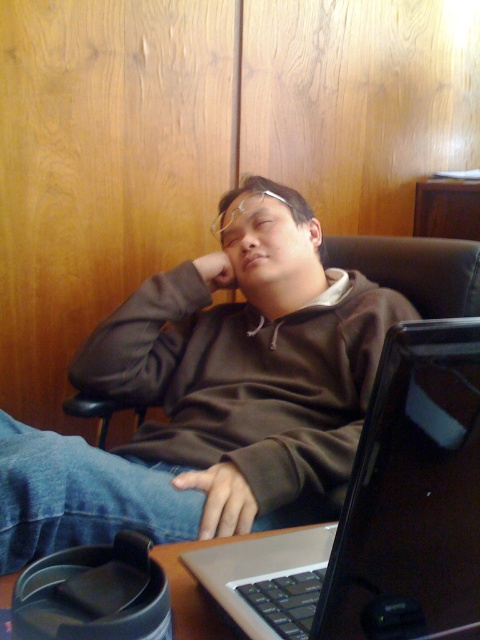
Question: Estimate the real-world distances between objects in this image. Which object is closer to the brown fleece at center?

Choices:
 (A) metallic silver laptop at lower center
 (B) silver metallic laptop at center

Answer: (A)

Question: Which point is closer to the camera?

Choices:
 (A) (335, 529)
 (B) (207, 621)
 (C) (361, 412)

Answer: (B)

Question: Can you confirm if brown fleece at center is thinner than silver metallic laptop at center?

Choices:
 (A) no
 (B) yes

Answer: (A)

Question: Which of the following is the closest to the observer?

Choices:
 (A) (269, 570)
 (B) (43, 476)

Answer: (A)

Question: From the image, what is the correct spatial relationship of brown fleece at center in relation to metallic silver laptop at lower center?

Choices:
 (A) right
 (B) left

Answer: (B)

Question: Can you confirm if silver metallic laptop at center is positioned below metallic silver laptop at lower center?

Choices:
 (A) no
 (B) yes

Answer: (A)